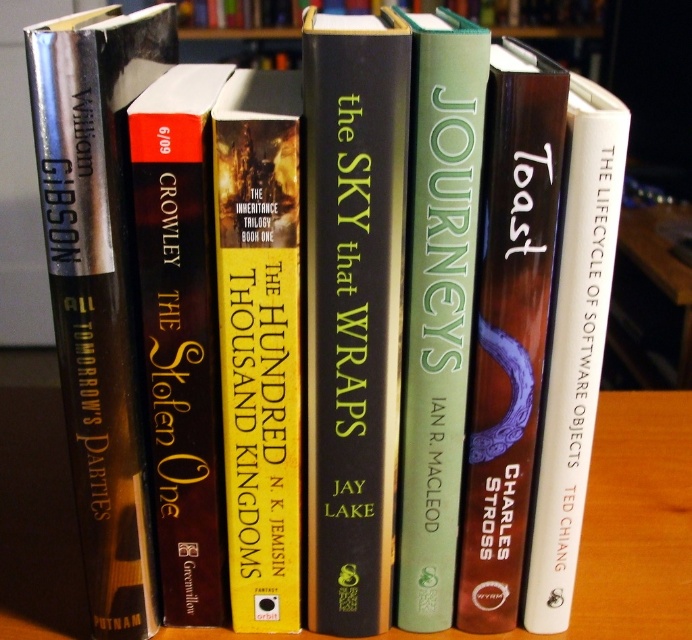
Question: Is green matte book at center smaller than dark brown leather book at center?

Choices:
 (A) yes
 (B) no

Answer: (A)

Question: Which object is closer to the camera taking this photo?

Choices:
 (A) hardcover book at center
 (B) silver metallic book at left
 (C) yellow hardcover book at center
 (D) white paper at center

Answer: (B)

Question: Based on their relative distances, which object is farther from the dark brown leather book at center?

Choices:
 (A) matte purple book at center
 (B) silver metallic book at left
 (C) white paper at center
 (D) green matte book at center

Answer: (C)

Question: Does wooden table at center appear on the right side of dark brown leather book at center?

Choices:
 (A) yes
 (B) no

Answer: (A)

Question: Can you confirm if hardcover book at center is positioned below silver metallic book at left?

Choices:
 (A) yes
 (B) no

Answer: (A)

Question: Considering the real-world distances, which object is farthest from the green matte book at center?

Choices:
 (A) silver metallic book at left
 (B) wooden table at center
 (C) dark brown leather book at center
 (D) hardcover book at center

Answer: (B)